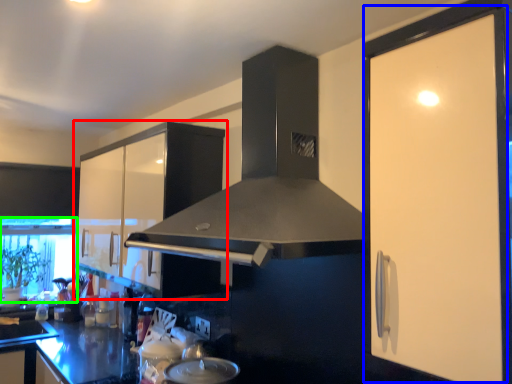
Question: Estimate the real-world distances between objects in this image. Which object is farther from cabinetry (highlighted by a red box), screen door (highlighted by a blue box) or window screen (highlighted by a green box)?

Choices:
 (A) screen door
 (B) window screen

Answer: (A)